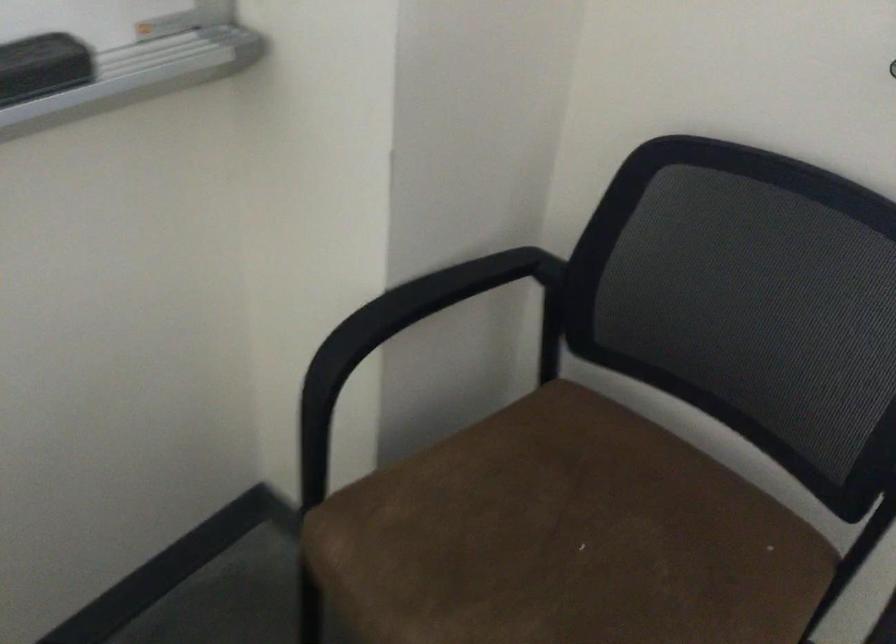
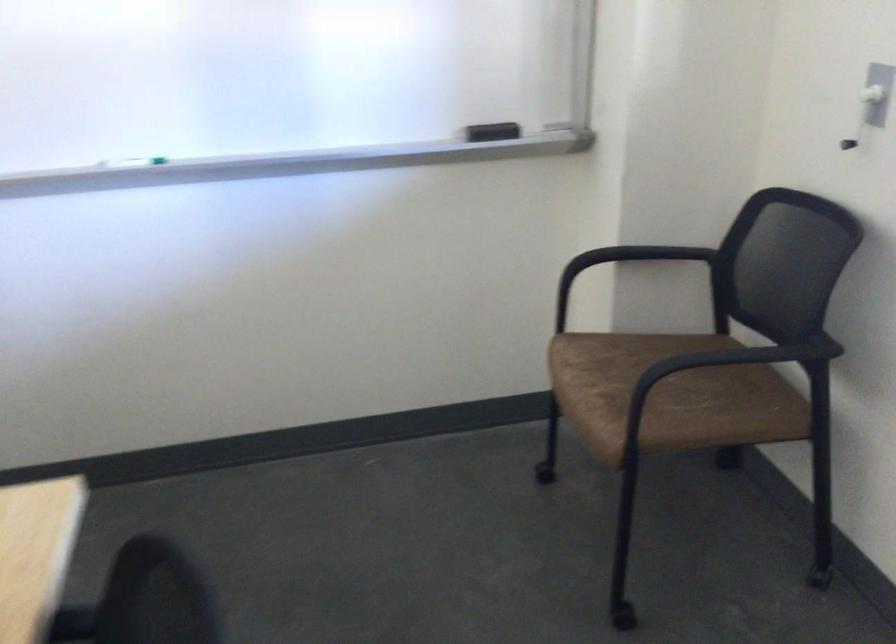
Find the pixel in the second image that matches point 389,317 in the first image.

(621, 263)